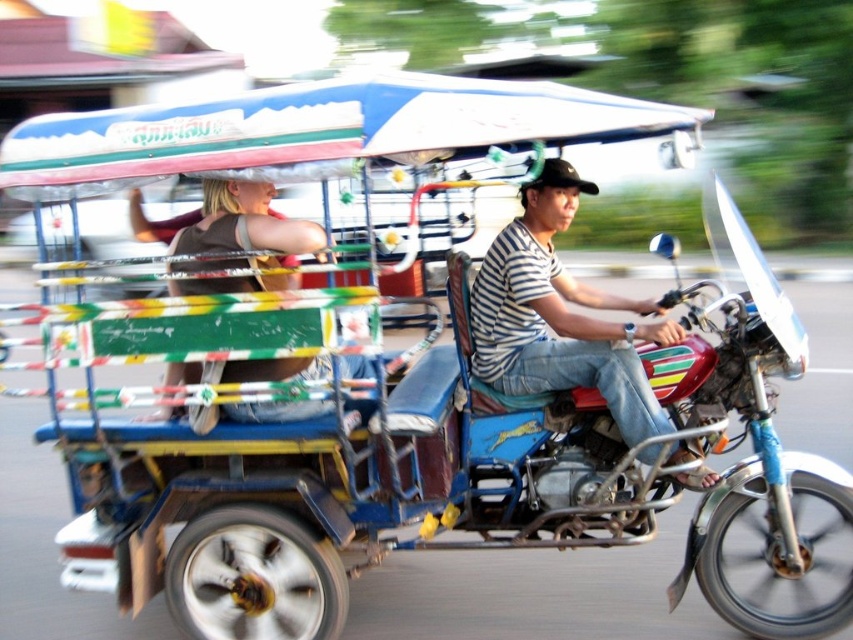
Question: Does metallic blue motorcycle at center lie behind brown fabric shirt at left?

Choices:
 (A) no
 (B) yes

Answer: (B)

Question: Which point is closer to the camera taking this photo?

Choices:
 (A) (236, 365)
 (B) (352, 449)
 (C) (579, 296)

Answer: (B)

Question: Is metallic blue motorcycle at center wider than striped shirt at center?

Choices:
 (A) no
 (B) yes

Answer: (B)

Question: Based on their relative distances, which object is nearer to the brown fabric shirt at left?

Choices:
 (A) metallic blue motorcycle at center
 (B) striped shirt at center

Answer: (A)

Question: Is metallic blue motorcycle at center bigger than brown fabric shirt at left?

Choices:
 (A) yes
 (B) no

Answer: (A)

Question: Which of these objects is positioned farthest from the brown fabric shirt at left?

Choices:
 (A) metallic blue motorcycle at center
 (B) striped shirt at center

Answer: (B)